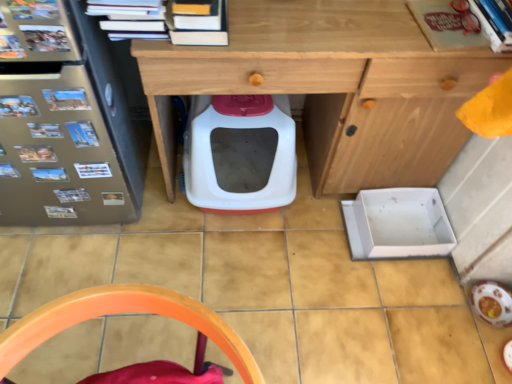
Find the location of a particular element. Image resolution: width=512 pixels, height=384 pixels. vacant area that lies to the right of hardcover books at upper center, the third book when ordered from right to left is located at coordinates (267, 27).